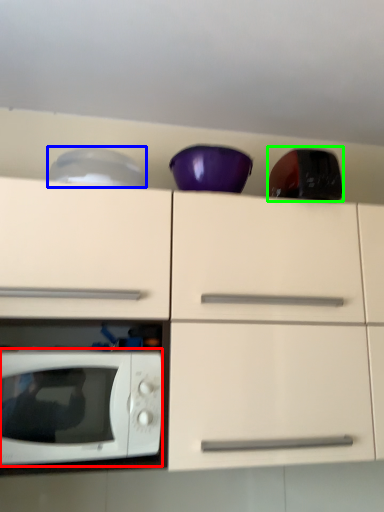
Question: Considering the real-world distances, which object is farthest from microwave oven (highlighted by a red box)? appliance (highlighted by a blue box) or appliance (highlighted by a green box)?

Choices:
 (A) appliance
 (B) appliance

Answer: (B)